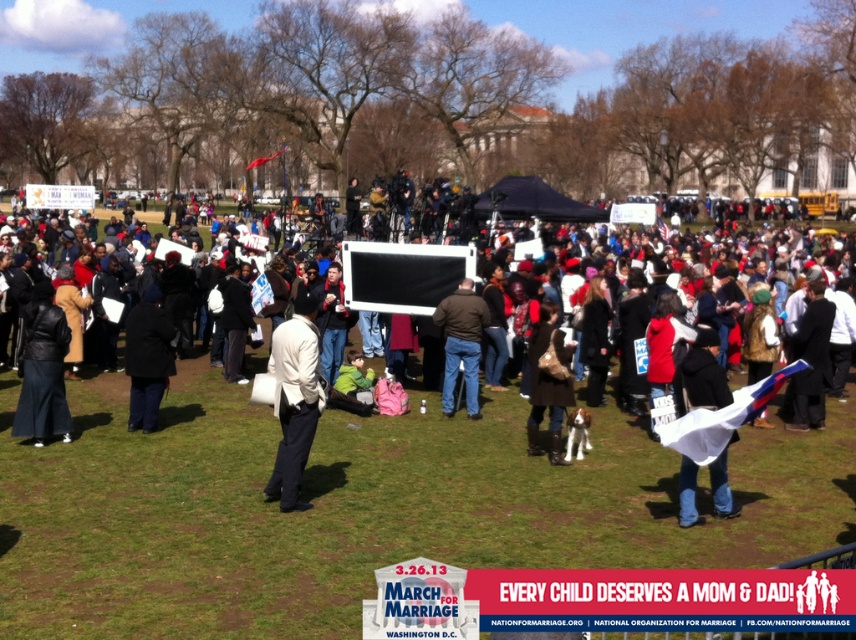
You are standing in the park and want to reach the point at coordinates [34,307]. If you can walk 4 feet per second, how long will it take you to reach that point?

The point at coordinates [34,307] is 36.86 feet away from the viewer. At a walking speed of 4 feet per second, it would take approximately 9.215 seconds to reach the point.

You are organizing a winter event and need to choose between the black leather jacket at lower left and the brown leather jacket at center for your staff. Which jacket would be better for colder weather?

The brown leather jacket at center is thicker, so it would be better for colder weather.

You are a photographer at the rally trying to capture a photo of the brown leather jacket at center without the black leather jacket at lower left blocking it. What should you do?

The black leather jacket at lower left is above the brown leather jacket at center, so you should lower your camera angle to avoid the black leather jacket at lower left blocking the view.